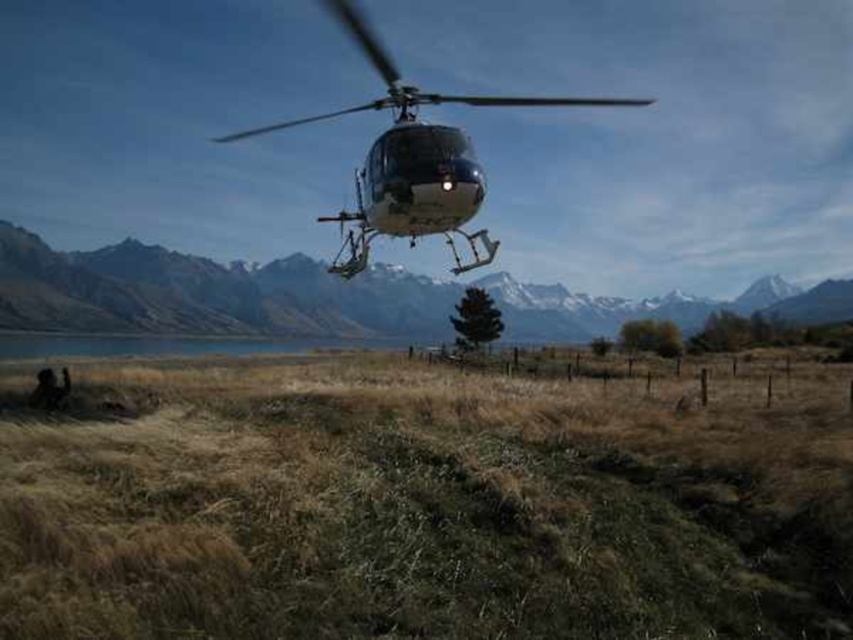
Is point (194, 314) less distant than point (459, 196)?

No, it is not.

Does matte gray helicopter at upper center have a smaller size compared to metallic silver helicopter at center?

Yes, matte gray helicopter at upper center is smaller than metallic silver helicopter at center.

Is point (194, 308) farther from camera compared to point (351, 1)?

Yes, point (194, 308) is farther from viewer.

I want to click on matte gray helicopter at upper center, so click(206, 292).

Is dry grass at lower left below metallic silver helicopter at center?

Yes.

Between dry grass at lower left and metallic silver helicopter at center, which one is positioned lower?

dry grass at lower left is below.

Is point (271, 369) farther from camera compared to point (401, 136)?

Yes, point (271, 369) is behind point (401, 136).

At what (x,y) coordinates should I click in order to perform the action: click on dry grass at lower left. Please return your answer as a coordinate pair (x, y). Looking at the image, I should click on (426, 506).

Does dry grass at lower left appear on the right side of matte gray helicopter at upper center?

Correct, you'll find dry grass at lower left to the right of matte gray helicopter at upper center.

Identify the location of dry grass at lower left. The height and width of the screenshot is (640, 853). (426, 506).